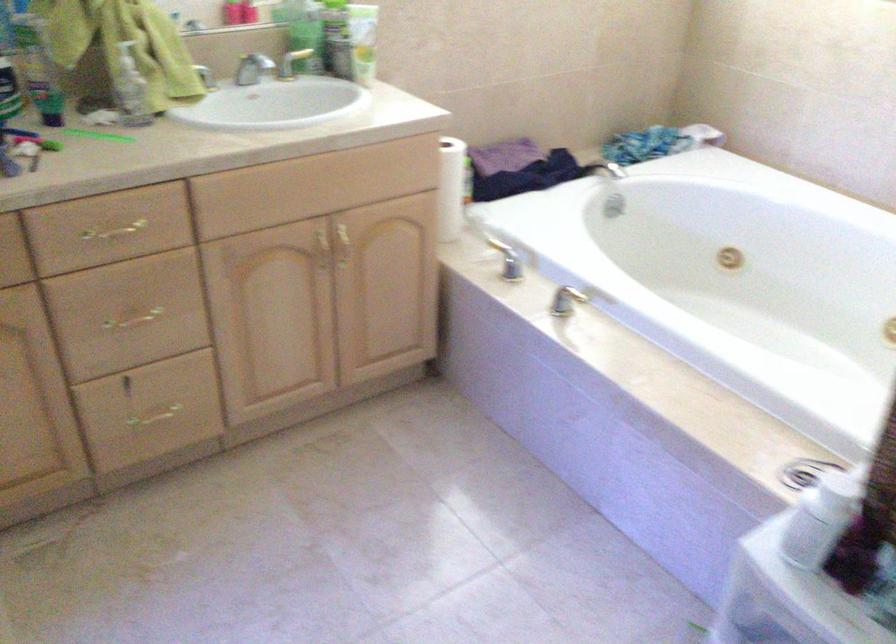
Identify the location of white bottle pump. pyautogui.click(x=814, y=527).